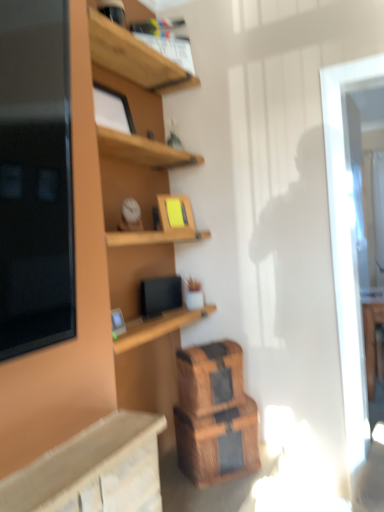
Question: Does wooden crate at lower center, acting as the 2th crate starting from the top, lie behind wooden crate at lower center, the 1th crate positioned from the top?

Choices:
 (A) no
 (B) yes

Answer: (A)

Question: Is wooden crate at lower center, acting as the 2th crate starting from the top, facing away from wooden crate at lower center, the 1th crate positioned from the top?

Choices:
 (A) yes
 (B) no

Answer: (B)

Question: Would you say wooden crate at lower center, the 1th crate positioned from the top, is part of wooden crate at lower center, positioned as the 1th crate in bottom-to-top order,'s contents?

Choices:
 (A) yes
 (B) no

Answer: (B)

Question: Could you tell me if wooden crate at lower center, acting as the 2th crate starting from the top, is facing wooden crate at lower center, the 1th crate positioned from the top?

Choices:
 (A) no
 (B) yes

Answer: (A)

Question: Is wooden crate at lower center, acting as the 2th crate starting from the top, positioned beyond the bounds of wooden crate at lower center, the second crate from the bottom?

Choices:
 (A) no
 (B) yes

Answer: (B)

Question: Does wooden crate at lower center, acting as the 2th crate starting from the top, have a greater width compared to wooden crate at lower center, the second crate from the bottom?

Choices:
 (A) yes
 (B) no

Answer: (A)

Question: Considering the relative sizes of wooden crate at lower center, positioned as the 1th crate in bottom-to-top order, and wooden shelf at upper center in the image provided, is wooden crate at lower center, positioned as the 1th crate in bottom-to-top order, shorter than wooden shelf at upper center?

Choices:
 (A) no
 (B) yes

Answer: (B)

Question: Is wooden crate at lower center, acting as the 2th crate starting from the top, completely or partially outside of wooden shelf at upper center?

Choices:
 (A) no
 (B) yes

Answer: (B)

Question: Is wooden shelf at upper center surrounded by wooden crate at lower center, positioned as the 1th crate in bottom-to-top order?

Choices:
 (A) no
 (B) yes

Answer: (A)

Question: Considering the relative sizes of wooden crate at lower center, positioned as the 1th crate in bottom-to-top order, and wooden shelf at upper center in the image provided, is wooden crate at lower center, positioned as the 1th crate in bottom-to-top order, smaller than wooden shelf at upper center?

Choices:
 (A) no
 (B) yes

Answer: (A)

Question: Is wooden crate at lower center, acting as the 2th crate starting from the top, with wooden shelf at upper center?

Choices:
 (A) no
 (B) yes

Answer: (A)

Question: Is wooden crate at lower center, acting as the 2th crate starting from the top, in front of wooden shelf at upper center?

Choices:
 (A) no
 (B) yes

Answer: (B)

Question: Does wooden crate at lower center, the 1th crate positioned from the top, have a smaller size compared to wooden crate at lower center, positioned as the 1th crate in bottom-to-top order?

Choices:
 (A) no
 (B) yes

Answer: (B)